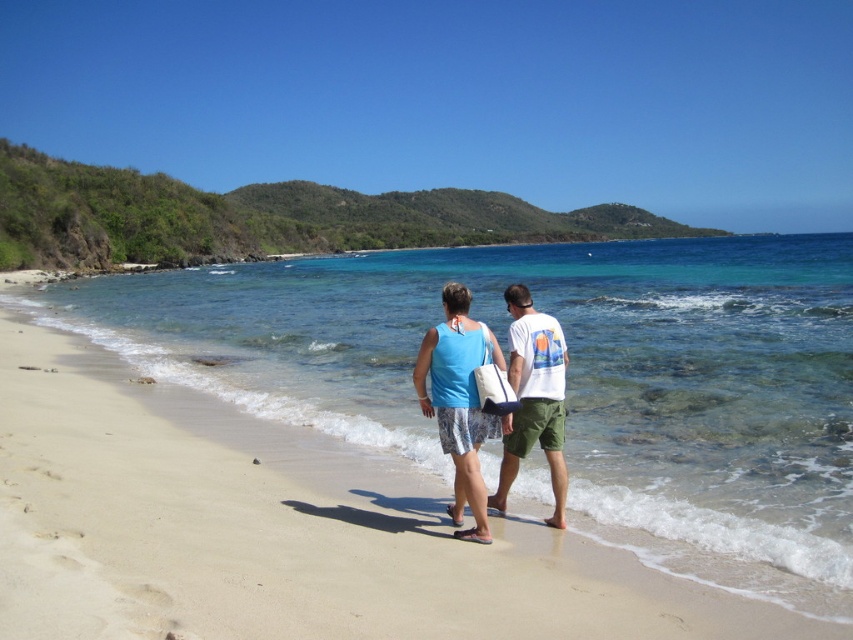
You are standing at the camera position and want to reach the point marked as point (456, 438) on the beach. If you can walk 3 feet per second, how many seconds will it take you to reach that point?

The distance between the camera and point (456, 438) is 19.47 feet. At a walking speed of 3 feet per second, it will take approximately 6.49 seconds to reach the point.